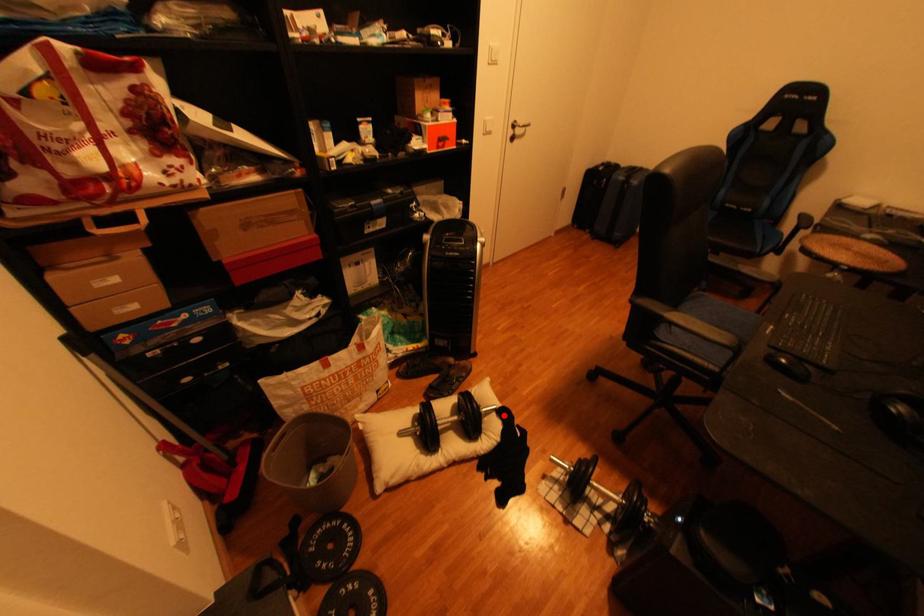
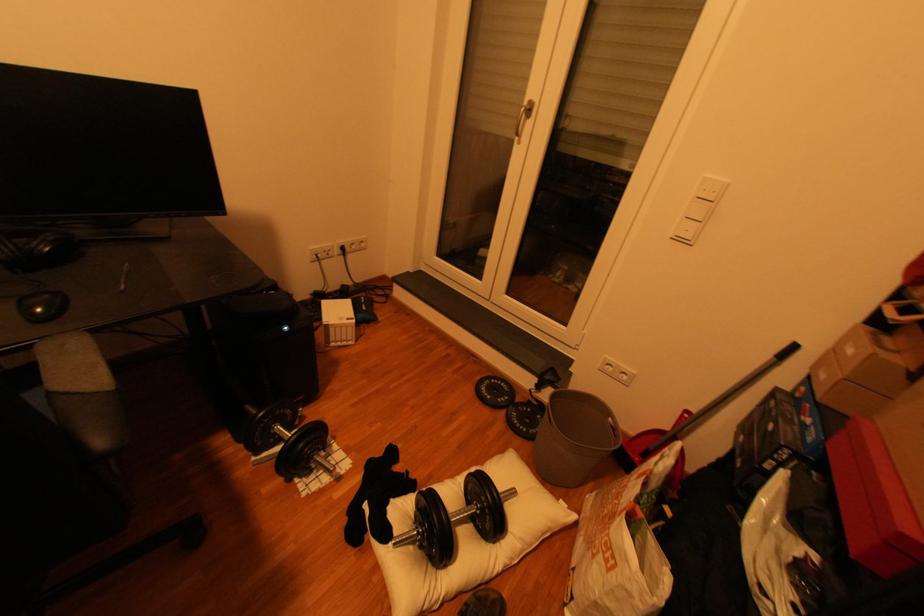
The point at the highlighted location is marked in the first image. Where is the corresponding point in the second image?

(406, 533)